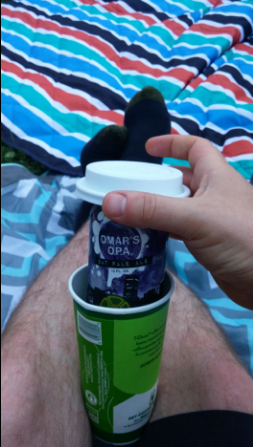
I want to click on blanket, so click(x=220, y=61).